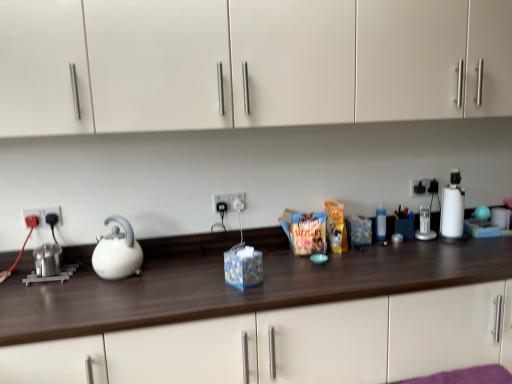
Measure the distance between white matte cabinet at upper center and camera.

white matte cabinet at upper center is 4.59 feet away from camera.

Image resolution: width=512 pixels, height=384 pixels. In order to click on transparent plastic bottle at right in this screenshot , I will do `click(381, 223)`.

Measure the distance between point [420,225] and camera.

A distance of 6.83 feet exists between point [420,225] and camera.

The width and height of the screenshot is (512, 384). Describe the element at coordinates (425, 225) in the screenshot. I see `white plastic coffee machine at right` at that location.

What do you see at coordinates (424, 187) in the screenshot? This screenshot has width=512, height=384. I see `black plastic electric outlet at upper right, arranged as the third electric outlet when viewed from the left` at bounding box center [424, 187].

Find the location of a particular element. The image size is (512, 384). white glossy kettle at left is located at coordinates (117, 251).

Is transparent plastic bottle at right next to white matte cabinet at upper center and touching it?

transparent plastic bottle at right is not next to white matte cabinet at upper center, and they're not touching.

In the scene shown: Considering the relative sizes of transparent plastic bottle at right and white matte cabinet at upper center in the image provided, is transparent plastic bottle at right wider than white matte cabinet at upper center?

Incorrect, the width of transparent plastic bottle at right does not surpass that of white matte cabinet at upper center.

Is transparent plastic bottle at right spatially inside white matte cabinet at upper center, or outside of it?

transparent plastic bottle at right lies outside white matte cabinet at upper center.

Is black plastic electrical outlet at left, which ranks as the 1th electric outlet in left-to-right order, looking in the opposite direction of white plastic coffee machine at right?

No, white plastic coffee machine at right is not at the back of black plastic electrical outlet at left, which ranks as the 1th electric outlet in left-to-right order.

Would you say black plastic electrical outlet at left, the first electric outlet from the front, contains white plastic coffee machine at right?

That's incorrect, white plastic coffee machine at right is not inside black plastic electrical outlet at left, the first electric outlet from the front.

Is point (51, 208) positioned in front of point (426, 213)?

Yes, it is in front of point (426, 213).

From the image's perspective, is wooden counter at center on top of polished stainless steel kettle at left?

No, from the image's perspective, wooden counter at center is not on top of polished stainless steel kettle at left.

From a real-world perspective, which object stands above the other?

From a 3D spatial view, polished stainless steel kettle at left is above.

Which object is more forward, wooden counter at center or polished stainless steel kettle at left?

wooden counter at center is closer to the camera.

Is white plastic coffee machine at right placed right next to transparent plastic bottle at right?

No, white plastic coffee machine at right is not beside transparent plastic bottle at right.

Locate an element on the screen. The height and width of the screenshot is (384, 512). bottle lying behind the white plastic coffee machine at right is located at coordinates (381, 223).

Can you tell me how much white plastic coffee machine at right and transparent plastic bottle at right differ in facing direction?

21.9 degrees separate the facing orientations of white plastic coffee machine at right and transparent plastic bottle at right.

Is white plastic coffee machine at right not inside transparent plastic bottle at right?

Indeed, white plastic coffee machine at right is completely outside transparent plastic bottle at right.

Who is bigger, polished stainless steel kettle at left or white plastic coffee machine at right?

polished stainless steel kettle at left.

From a real-world perspective, who is located higher, polished stainless steel kettle at left or white plastic coffee machine at right?

From a 3D spatial view, white plastic coffee machine at right is above.

Considering the relative positions of polished stainless steel kettle at left and white plastic coffee machine at right in the image provided, is polished stainless steel kettle at left behind white plastic coffee machine at right?

No, polished stainless steel kettle at left is closer to the camera.

Is polished stainless steel kettle at left looking in the opposite direction of white plastic coffee machine at right?

No.

Is black plastic electric outlet at upper right, arranged as the third electric outlet when viewed from the left, touching white plastic blender at right?

black plastic electric outlet at upper right, arranged as the third electric outlet when viewed from the left, is not next to white plastic blender at right, and they're not touching.

Consider the image. Is black plastic electric outlet at upper right, arranged as the third electric outlet when viewed from the left, to the left or to the right of white plastic blender at right in the image?

Based on their positions, black plastic electric outlet at upper right, arranged as the third electric outlet when viewed from the left, is located to the left of white plastic blender at right.

Considering the positions of points (424, 192) and (455, 229), is point (424, 192) closer to camera compared to point (455, 229)?

No.

From a real-world perspective, which object rests below the other?

white plastic blender at right is physically lower.

Looking at this image, considering the sizes of objects white matte cabinet at upper center and black plastic electrical outlet at left, the first electric outlet from the front, in the image provided, who is wider, white matte cabinet at upper center or black plastic electrical outlet at left, the first electric outlet from the front,?

With larger width is white matte cabinet at upper center.

Does white matte cabinet at upper center contain black plastic electrical outlet at left, which ranks as the third electric outlet in back-to-front order?

No, black plastic electrical outlet at left, which ranks as the third electric outlet in back-to-front order, is not inside white matte cabinet at upper center.

Considering the positions of point (313, 87) and point (35, 209), is point (313, 87) closer or farther from the camera than point (35, 209)?

Point (313, 87) is positioned closer to the camera compared to point (35, 209).

This screenshot has width=512, height=384. Find the location of `cabinetry above the transparent plastic bottle at right (from the image's perspective)`. cabinetry above the transparent plastic bottle at right (from the image's perspective) is located at coordinates (249, 63).

From a real-world perspective, count 1st electric outlets upward from the white plastic coffee machine at right and point to it. Please provide its 2D coordinates.

[(42, 214)]

When comparing their distances from white matte cabinet at upper center, does wooden counter at center or black plastic electrical outlet at left, which ranks as the third electric outlet in back-to-front order, seem further?

The object further to white matte cabinet at upper center is black plastic electrical outlet at left, which ranks as the third electric outlet in back-to-front order.

Based on their spatial positions, is transparent plastic bottle at right or black plastic electrical outlet at left, the 3th electric outlet in the right-to-left sequence, further from white plastic blender at right?

black plastic electrical outlet at left, the 3th electric outlet in the right-to-left sequence.

Looking at the image, which one is located further to polished stainless steel kettle at left, black plastic electrical outlet at left, the first electric outlet from the front, or black plastic electric outlet at upper right, the third electric outlet viewed from the front?

Among the two, black plastic electric outlet at upper right, the third electric outlet viewed from the front, is located further to polished stainless steel kettle at left.

Considering their positions, is white plastic electric outlet at center, acting as the 2th electric outlet starting from the front, positioned further to wooden counter at center than black plastic electrical outlet at left, the 3th electric outlet in the right-to-left sequence?

Based on the image, black plastic electrical outlet at left, the 3th electric outlet in the right-to-left sequence, appears to be further to wooden counter at center.

From the image, which object appears to be nearer to wooden counter at center, white glossy kettle at left or white plastic electric outlet at center, the 2th electric outlet when ordered from left to right?

white glossy kettle at left is positioned closer to the anchor wooden counter at center.

From the image, which object appears to be farther from transparent plastic bottle at right, wooden counter at center or white plastic blender at right?

Based on the image, wooden counter at center appears to be further to transparent plastic bottle at right.

Looking at the image, which one is located closer to wooden counter at center, white plastic coffee machine at right or polished stainless steel kettle at left?

Among the two, polished stainless steel kettle at left is located nearer to wooden counter at center.

Considering their positions, is white plastic coffee machine at right positioned further to black plastic electric outlet at upper right, the first electric outlet when ordered from back to front, than polished stainless steel kettle at left?

polished stainless steel kettle at left.

The image size is (512, 384). Identify the location of kettle located between polished stainless steel kettle at left and white plastic coffee machine at right in the left-right direction. (117, 251).

You are a GUI agent. You are given a task and a screenshot of the screen. Output one action in this format:
    pyautogui.click(x=<x>, y=<y>)
    Task: Click on the bottle between white plastic electric outlet at center, which appears as the second electric outlet when viewed from the back, and white plastic coffee machine at right, in the horizontal direction
    Image resolution: width=512 pixels, height=384 pixels.
    Given the screenshot: What is the action you would take?
    pyautogui.click(x=381, y=223)

Locate an element on the screen. The height and width of the screenshot is (384, 512). cabinetry between white plastic electric outlet at center, the 2th electric outlet when ordered from left to right, and white plastic coffee machine at right is located at coordinates (249, 63).

Locate an element on the screen. The image size is (512, 384). coffee machine between black plastic electrical outlet at left, the 3th electric outlet in the right-to-left sequence, and black plastic electric outlet at upper right, the first electric outlet when ordered from back to front, from left to right is located at coordinates (425, 225).